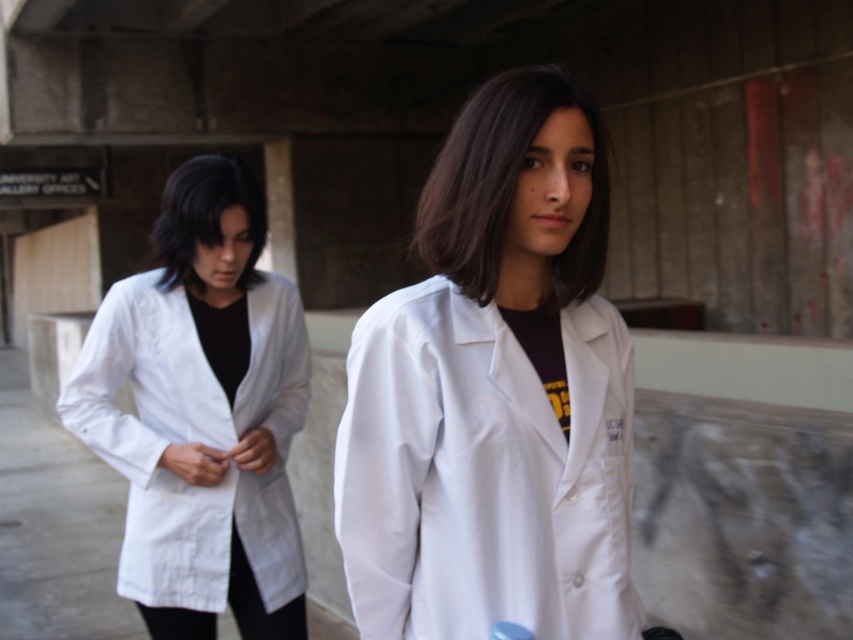
You are an observer standing in front of the image. You notice the matte white lab coat at center and the smooth black hair at left. Which object is taller in the image?

The matte white lab coat at center is much taller than the smooth black hair at left.

You are a photographer trying to capture a clear shot of both the white matte lab coat at center and the matte white lab coat at center in the image. Since they are both at the center, which one is more to the left?

The white matte lab coat at center is more to the left than the matte white lab coat at center.

You are a researcher trying to locate your colleague in the image. Your colleague is wearing the white matte lab coat at center. Based on the coordinates provided, can you determine if your colleague is positioned closer to the left or right side of the image?

The white matte lab coat at center is located at point 0.613 on the x and y axis, which means it is positioned closer to the right side of the image.